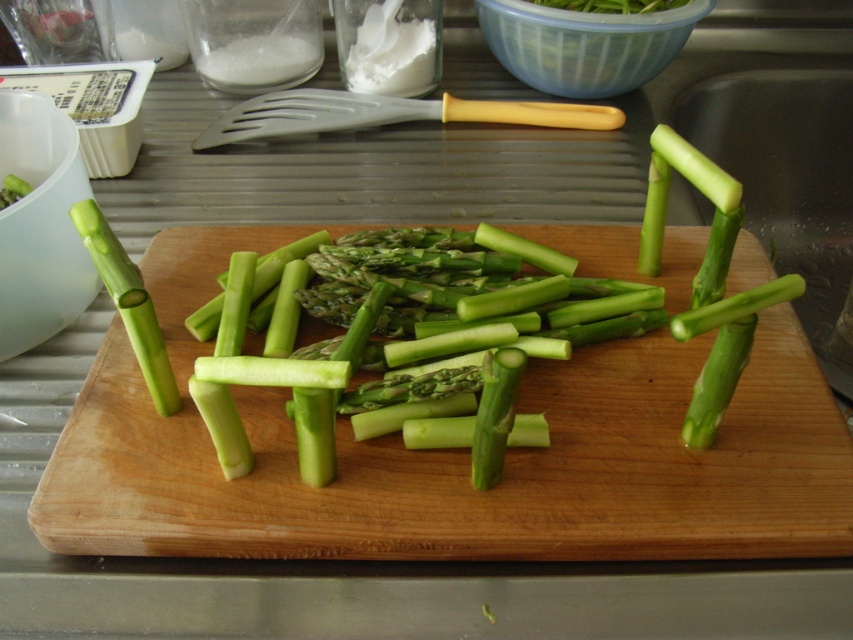
You are a chef preparing a dish and need to know the distance between the green wood cutting board at center and the green matte asparagus at left. Can you confirm if it is less than 10 inches?

The green wood cutting board at center is 8.71 inches away from the green matte asparagus at left, so yes, the distance is less than 10 inches.

You are preparing a dish and need to know if the green smooth asparagus at center can fit entirely on the green wood cutting board at center. Based on their sizes, can it fit?

The green wood cutting board at center has a larger size compared to green smooth asparagus at center, so the asparagus can fit entirely on the cutting board.

You are looking at the asparagus structure on the cutting board. There are two points labeled on the asparagus structure. Which point is closer to you, point (339, 344) or point (136, 321)?

Point (136, 321) is closer to you because it is less further to the camera than point (339, 344).